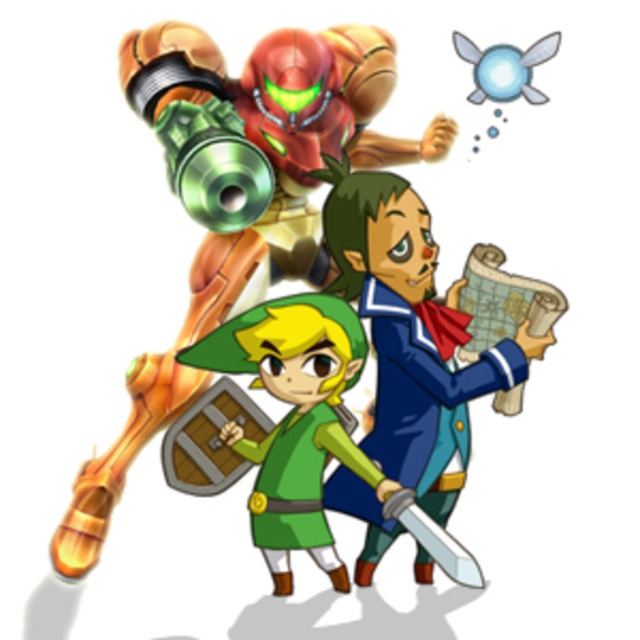
Between metallic gold suit at upper left and blue fabric map at center, which one appears on the left side from the viewer's perspective?

metallic gold suit at upper left is more to the left.

Can you confirm if metallic gold suit at upper left is smaller than blue fabric map at center?

No, metallic gold suit at upper left is not smaller than blue fabric map at center.

Is point (307, 115) positioned after point (416, 486)?

Yes, point (307, 115) is behind point (416, 486).

Where is `metallic gold suit at upper left`? The image size is (640, 640). metallic gold suit at upper left is located at coordinates (237, 198).